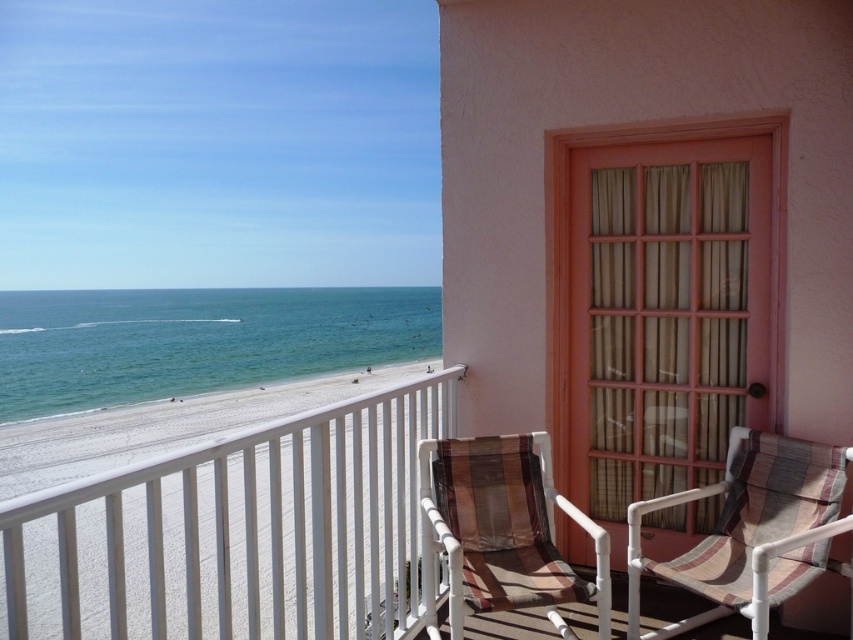
Question: Is white plastic balustrade at lower left wider than blue water at lower left?

Choices:
 (A) no
 (B) yes

Answer: (A)

Question: Where is blue water at lower left located in relation to brown striped fabric beach chair at center in the image?

Choices:
 (A) below
 (B) above

Answer: (B)

Question: Which object appears closest to the camera in this image?

Choices:
 (A) blue water at lower left
 (B) striped fabric beach chair at lower right
 (C) white plastic balustrade at lower left
 (D) brown striped fabric beach chair at center

Answer: (C)

Question: Based on their relative distances, which object is farther from the white plastic balustrade at lower left?

Choices:
 (A) blue water at lower left
 (B) striped fabric beach chair at lower right

Answer: (A)

Question: Considering the relative positions of blue water at lower left and brown striped fabric beach chair at center in the image provided, where is blue water at lower left located with respect to brown striped fabric beach chair at center?

Choices:
 (A) left
 (B) right

Answer: (A)

Question: Estimate the real-world distances between objects in this image. Which object is farther from the blue water at lower left?

Choices:
 (A) white plastic balustrade at lower left
 (B) striped fabric beach chair at lower right

Answer: (B)